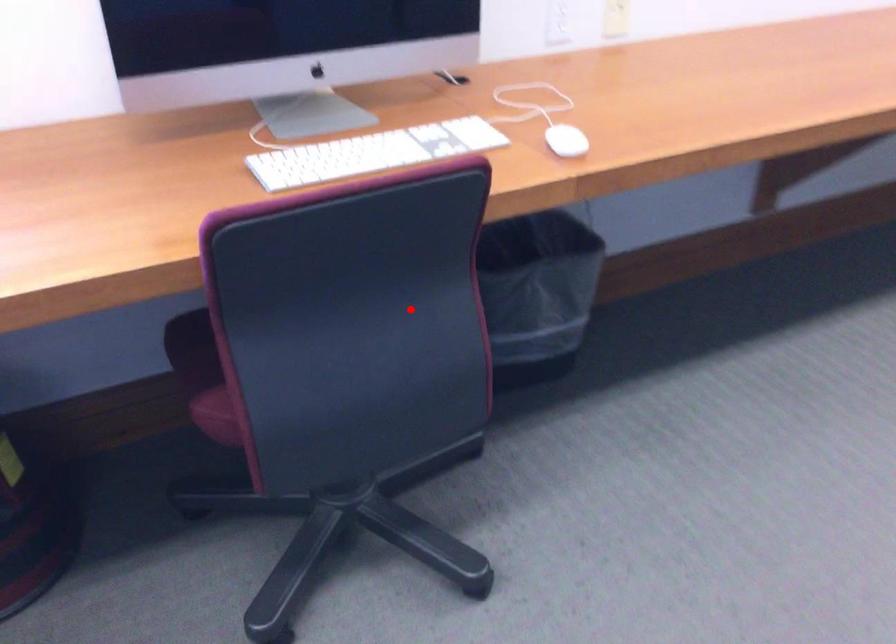
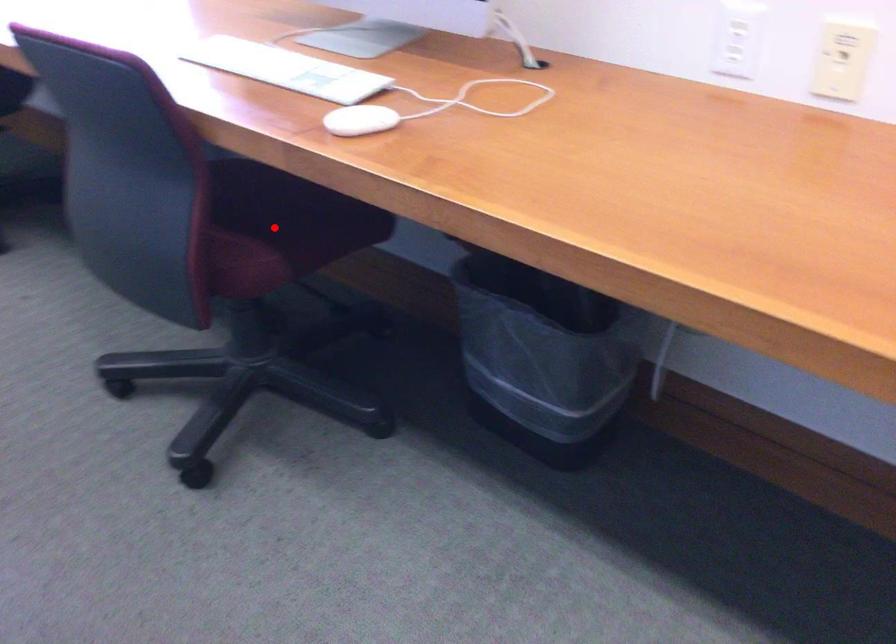
I am providing you with two images of the same scene from different viewpoints. A red point is marked on the first image and another point is marked on the second image. Is the red point in image1 aligned with the point shown in image2?

Yes